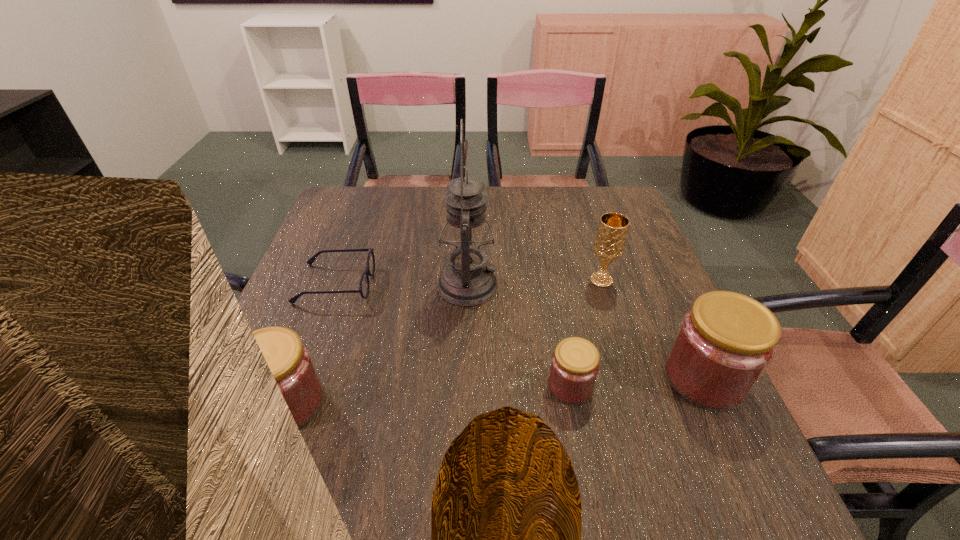
The height and width of the screenshot is (540, 960). Find the location of `object present at the near right corner`. object present at the near right corner is located at coordinates (724, 344).

Locate an element on the screen. Image resolution: width=960 pixels, height=540 pixels. blank space at the far edge of the desktop is located at coordinates (396, 227).

Where is `blank area at the near edge`? The image size is (960, 540). blank area at the near edge is located at coordinates (381, 423).

In the image, there is a desktop. At what (x,y) coordinates should I click in order to perform the action: click on free space at the left edge. Please return your answer as a coordinate pair (x, y). The height and width of the screenshot is (540, 960). Looking at the image, I should click on (359, 251).

Where is `vacant space at the right edge`? Image resolution: width=960 pixels, height=540 pixels. vacant space at the right edge is located at coordinates (674, 313).

The width and height of the screenshot is (960, 540). In the image, there is a desktop. Find the location of `vacant space at the far left corner`. vacant space at the far left corner is located at coordinates (350, 187).

Identify the location of free region at the near left corner of the desktop. This screenshot has width=960, height=540. (263, 441).

The image size is (960, 540). Find the location of `blank space at the far right corner`. blank space at the far right corner is located at coordinates (617, 197).

Find the location of a particular element. vacant area that lies between the fifth object from left to right and the fourth object from right to left is located at coordinates (534, 283).

Find the location of a particular element. The width and height of the screenshot is (960, 540). free point between the rightmost object and the spectacles is located at coordinates (520, 331).